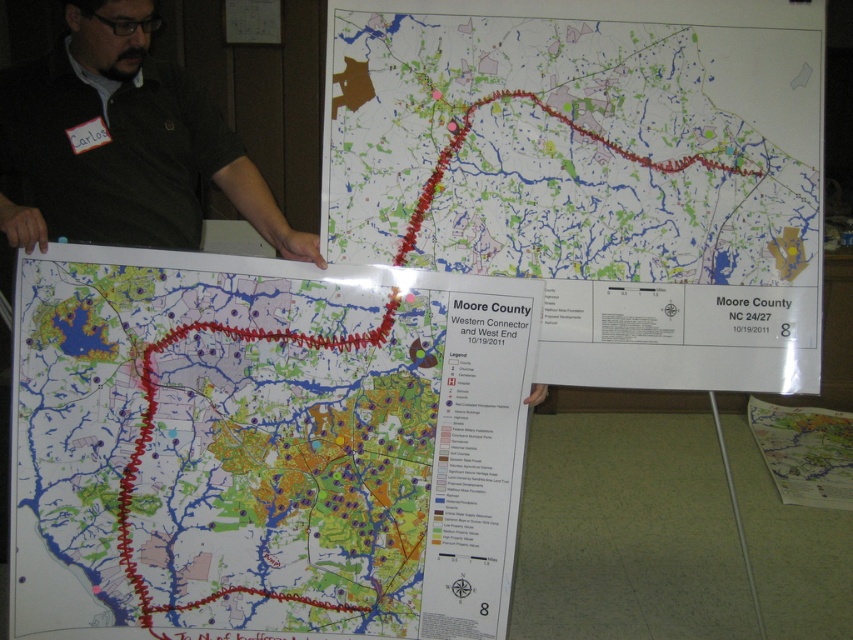
Question: Does white paper map at center have a greater width compared to map paper at center?

Choices:
 (A) no
 (B) yes

Answer: (B)

Question: Among these points, which one is nearest to the camera?

Choices:
 (A) (831, 451)
 (B) (82, 417)

Answer: (B)

Question: Does matte paper map at center appear under dark green shirt at upper left?

Choices:
 (A) no
 (B) yes

Answer: (B)

Question: Is matte paper map at center wider than white paper map at center?

Choices:
 (A) yes
 (B) no

Answer: (B)

Question: Which of these objects is positioned farthest from the matte paper map at center?

Choices:
 (A) white paper map at center
 (B) map paper at center

Answer: (B)

Question: Which point is closer to the camera?

Choices:
 (A) map paper at center
 (B) white paper map at center
 (C) dark green shirt at upper left

Answer: (C)